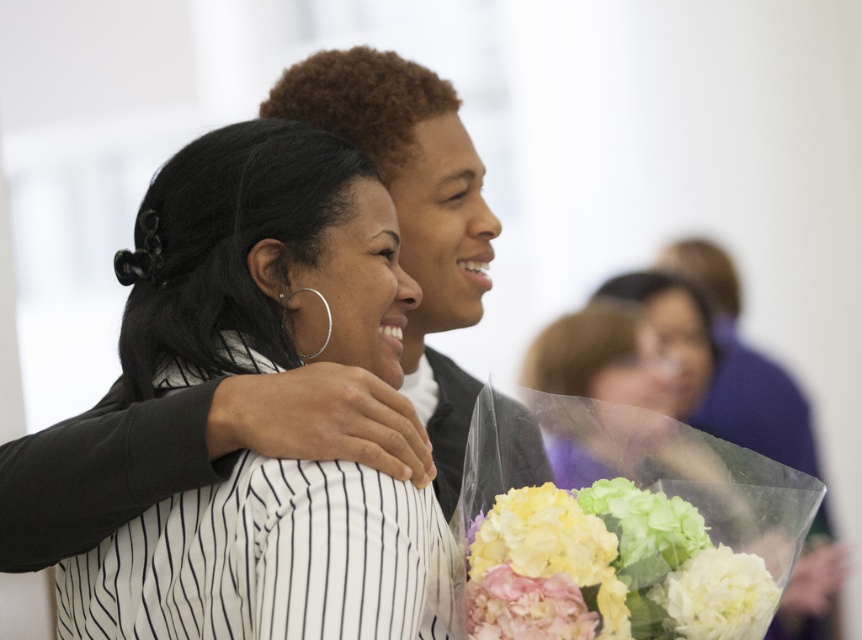
Can you confirm if pastel hydrangea bouquet at lower right is wider than white matte bouquet at lower right?

Indeed, pastel hydrangea bouquet at lower right has a greater width compared to white matte bouquet at lower right.

Does pastel hydrangea bouquet at lower right have a smaller size compared to white matte bouquet at lower right?

Incorrect, pastel hydrangea bouquet at lower right is not smaller in size than white matte bouquet at lower right.

Identify the location of pastel hydrangea bouquet at lower right. This screenshot has height=640, width=862. (608, 568).

Which is more to the left, black matte hair at center or pastel hydrangea bouquet at lower right?

From the viewer's perspective, black matte hair at center appears more on the left side.

Is black matte hair at center thinner than pastel hydrangea bouquet at lower right?

Incorrect, black matte hair at center's width is not less than pastel hydrangea bouquet at lower right's.

Is point (166, 524) positioned behind point (579, 556)?

Yes, it is behind point (579, 556).

In order to click on black matte hair at center in this screenshot , I will do `click(255, 259)`.

Who is higher up, black matte hair at center or pink silk flower at lower center?

black matte hair at center is higher up.

Is black matte hair at center positioned at the back of pink silk flower at lower center?

No, it is not.

Identify the location of black matte hair at center. (255, 259).

Where is `black matte hair at center`? black matte hair at center is located at coordinates (255, 259).